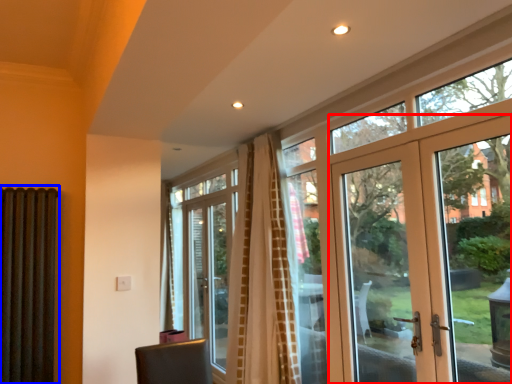
Question: Which object is further to the camera taking this photo, door (highlighted by a red box) or shutter (highlighted by a blue box)?

Choices:
 (A) door
 (B) shutter

Answer: (B)